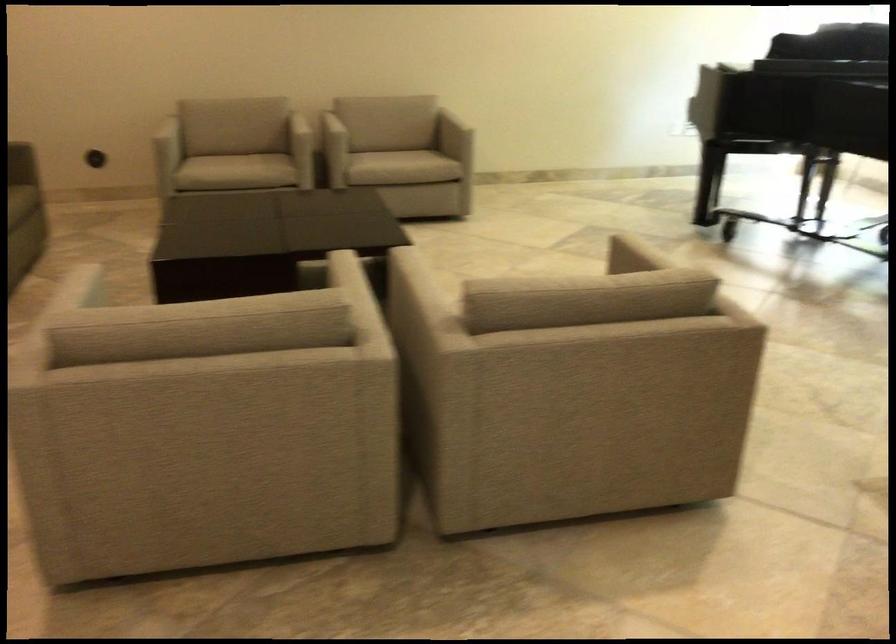
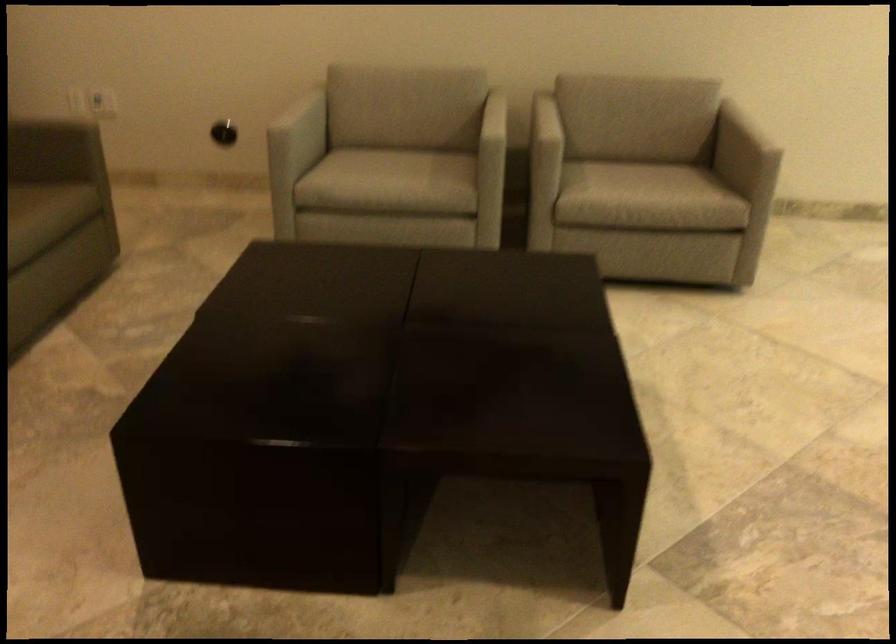
In the second image, find the point that corresponds to point 392,146 in the first image.

(633, 160)